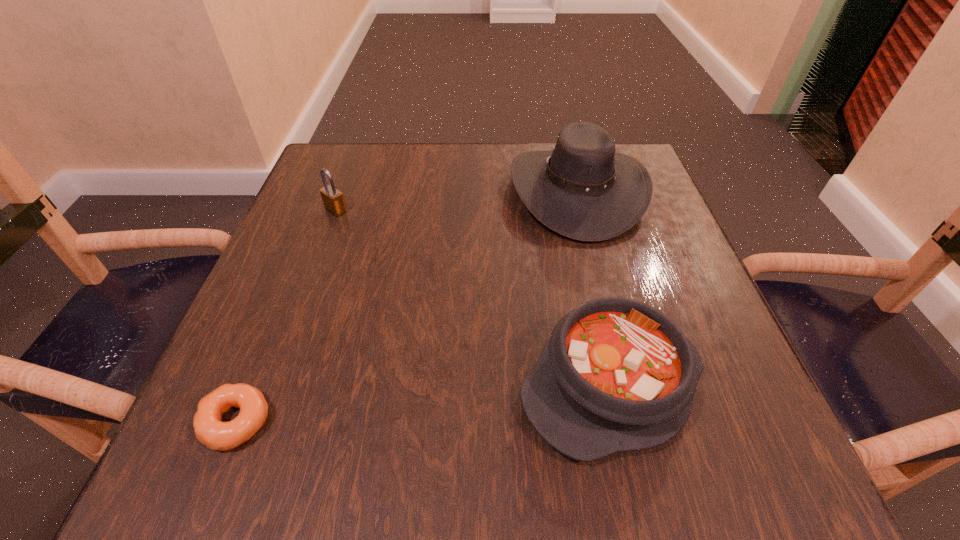
Where is `cowboy hat`? cowboy hat is located at coordinates (584, 190).

This screenshot has width=960, height=540. I want to click on padlock, so click(x=333, y=200).

Locate an element on the screen. The image size is (960, 540). casserole is located at coordinates (616, 375).

Image resolution: width=960 pixels, height=540 pixels. I want to click on doughnut, so click(x=209, y=429).

This screenshot has height=540, width=960. What are the coordinates of `blank area located on the front-facing side of the tallest object` in the screenshot? It's located at (374, 192).

Where is `vacant space situated on the front-facing side of the tallest object`? vacant space situated on the front-facing side of the tallest object is located at coordinates (443, 192).

Image resolution: width=960 pixels, height=540 pixels. Find the location of `free spot located 0.190m on the front-facing side of the tallest object`. free spot located 0.190m on the front-facing side of the tallest object is located at coordinates (424, 192).

Locate an element on the screen. The height and width of the screenshot is (540, 960). vacant region located 0.340m on the front of the padlock is located at coordinates (282, 355).

The image size is (960, 540). Identify the location of vacant space situated on the left of the casserole. (414, 384).

Locate an element on the screen. This screenshot has height=540, width=960. free space located 0.200m on the back of the shortest object is located at coordinates (290, 289).